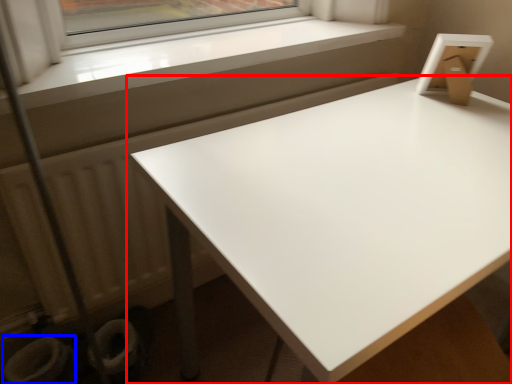
Question: Which point is closer to the camera, table (highlighted by a red box) or toilet bowl (highlighted by a blue box)?

Choices:
 (A) table
 (B) toilet bowl

Answer: (A)